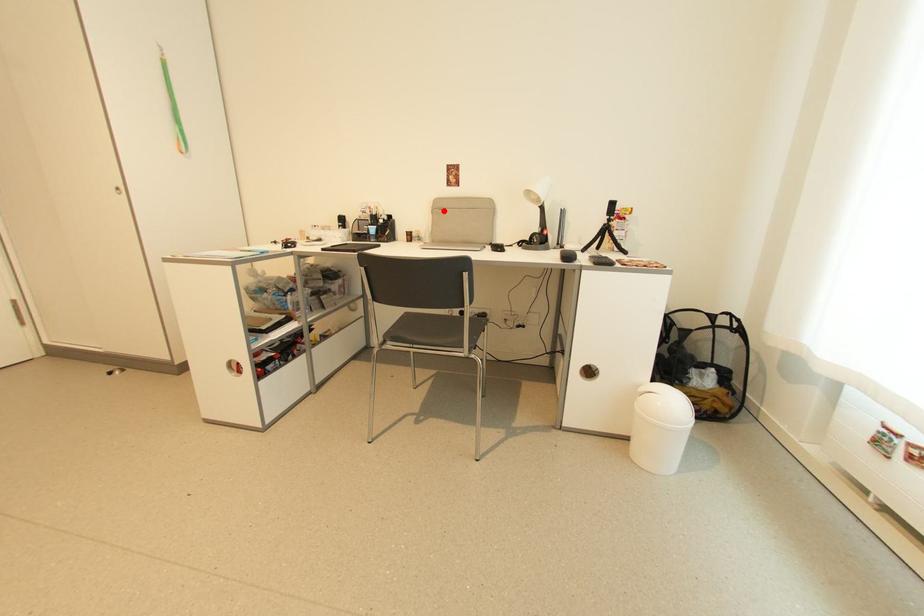
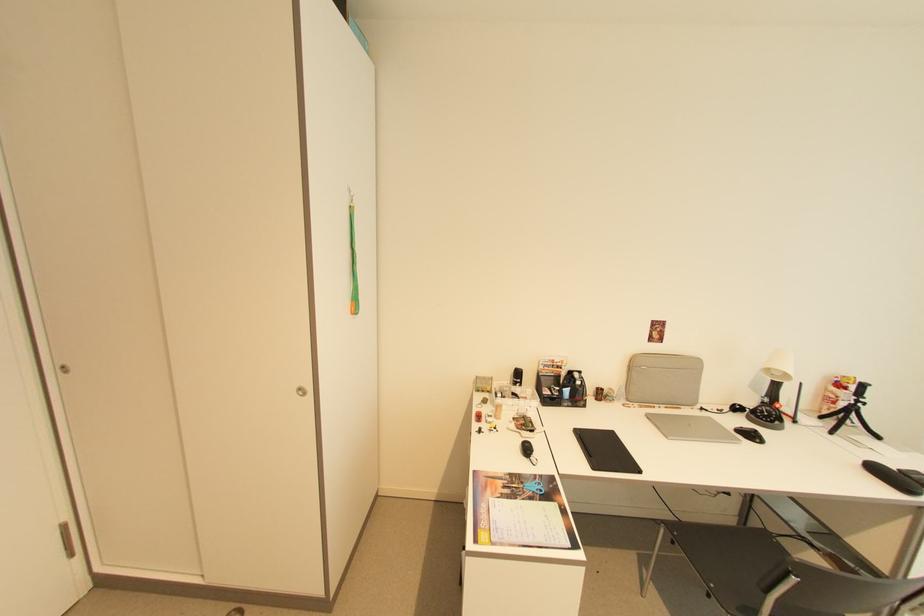
Question: A red point is marked in image1. In image2, is the corresponding 3D point closer to the camera or farther? Reply with the corresponding letter.

Choices:
 (A) The corresponding 3D point is closer.
 (B) The corresponding 3D point is farther.

Answer: (B)